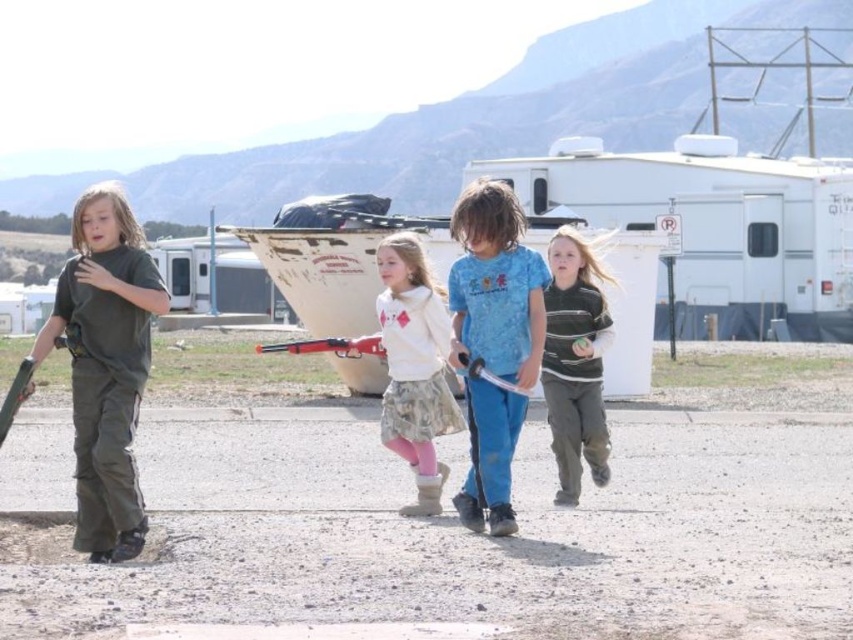
Question: Which point is farther to the camera?

Choices:
 (A) striped sweater at center
 (B) white matte boat at center
 (C) dirt track at lower center
 (D) blue cotton shirt at center

Answer: (B)

Question: Is white plastic trailer at center wider than white cotton hoodie at center?

Choices:
 (A) yes
 (B) no

Answer: (A)

Question: Estimate the real-world distances between objects in this image. Which object is farther from the white cotton hoodie at center?

Choices:
 (A) dirt track at lower center
 (B) blue cotton shirt at center

Answer: (A)

Question: Which object is the closest to the white cotton hoodie at center?

Choices:
 (A) white plastic trailer at center
 (B) matte black shirt at left
 (C) white matte boat at center

Answer: (B)

Question: In this image, where is matte black shirt at left located relative to white matte boat at center?

Choices:
 (A) left
 (B) right

Answer: (A)

Question: Can you confirm if dirt track at lower center is positioned to the right of matte black shirt at left?

Choices:
 (A) no
 (B) yes

Answer: (B)